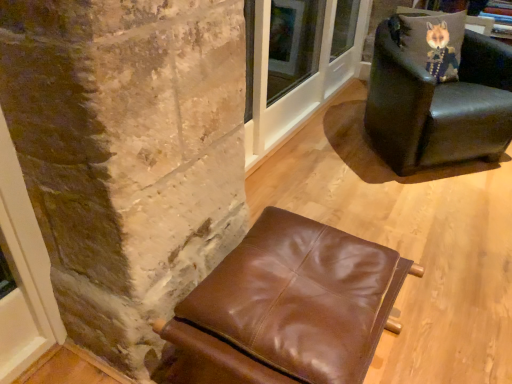
Locate an element on the screen. The image size is (512, 384). free space between brown leather ottoman at lower center, acting as the second chair starting from the right, and leather armchair at upper right, marked as the 2th chair in a front-to-back arrangement is located at coordinates (399, 222).